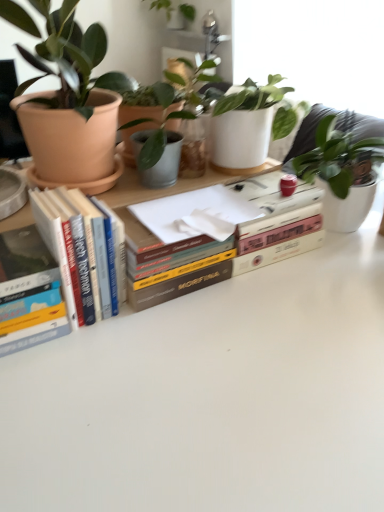
Question: From the image's perspective, is hardcover book at left, the 1th book positioned from the left, positioned above or below green matte plant at upper center, which is the 3th houseplant in front-to-back order?

Choices:
 (A) above
 (B) below

Answer: (B)

Question: Does point coord(21,330) appear closer or farther from the camera than point coord(168,5)?

Choices:
 (A) closer
 (B) farther

Answer: (A)

Question: Estimate the real-world distances between objects in this image. Which object is farther from the matte terracotta pot at left, the second houseplant positioned from the bottom?

Choices:
 (A) hardcover book at left, the third book in the right-to-left sequence
 (B) hardcover books at left, acting as the second book starting from the left
 (C) hardcover book at center, the third book in the left-to-right sequence
 (D) green matte plant at upper center, positioned as the 1th houseplant in back-to-front order
 (E) matte terracotta pot at upper left, which is the first houseplant in bottom-to-top order

Answer: (D)

Question: Which is nearer to the green matte plant at upper center, which is counted as the 1th houseplant, starting from the top?

Choices:
 (A) hardcover book at center, the third book in the left-to-right sequence
 (B) hardcover book at left, the third book in the right-to-left sequence
 (C) matte terracotta pot at left, which is counted as the 1th houseplant, starting from the front
 (D) matte terracotta pot at upper left, which is the first houseplant in bottom-to-top order
 (E) hardcover books at left, the 2th book from the right

Answer: (D)